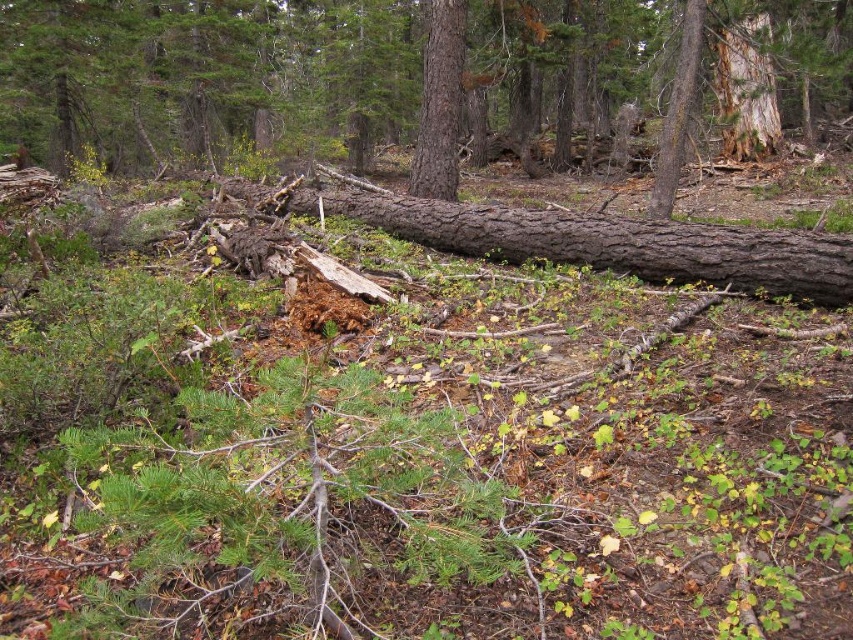
Which is above, brown rough log at center or smooth brown tree trunk at center?

Positioned higher is brown rough log at center.

The image size is (853, 640). Find the location of `brown rough log at center`. brown rough log at center is located at coordinates (415, 81).

Locate an element on the screen. brown rough log at center is located at coordinates (415, 81).